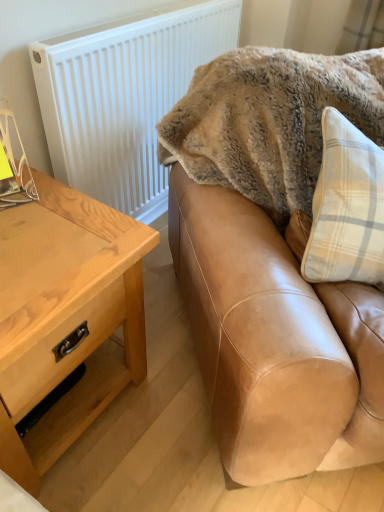
Identify the location of free space above light brown wood table at left (from a real-world perspective). (48, 227).